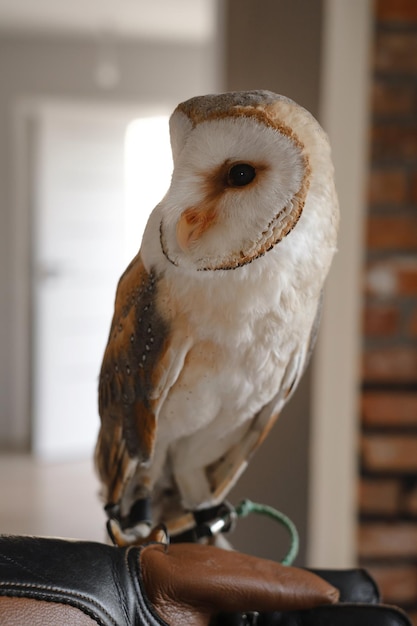
At what (x,y) coordinates should I click in order to perform the action: click on leather material. Please return your answer as a coordinate pair (x, y). Image resolution: width=417 pixels, height=626 pixels. Looking at the image, I should click on (176, 577).